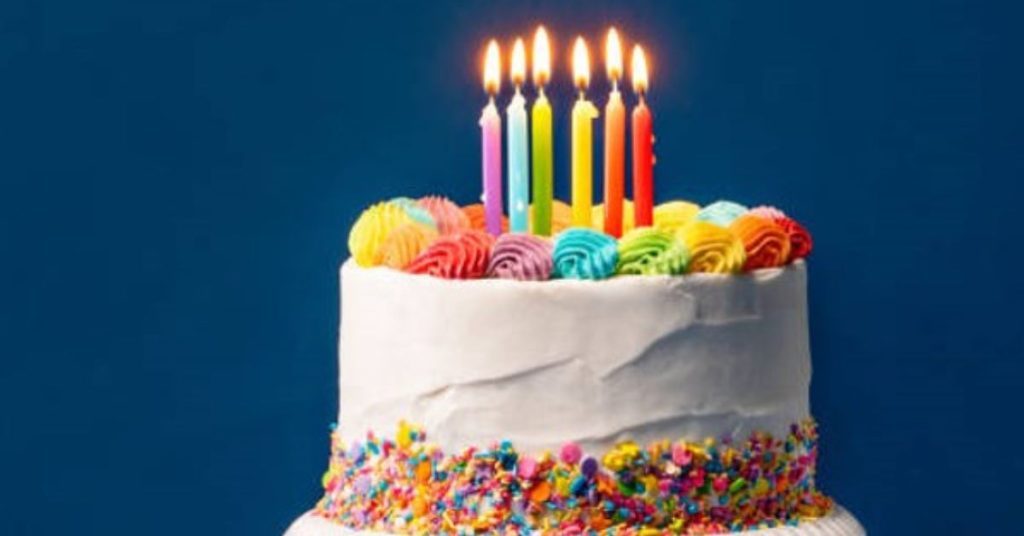
You are a GUI agent. You are given a task and a screenshot of the screen. Output one action in this format:
    pyautogui.click(x=<x>, y=<y>)
    Task: Click on the candle
    The height and width of the screenshot is (536, 1024).
    Given the screenshot: What is the action you would take?
    pyautogui.click(x=489, y=142), pyautogui.click(x=517, y=142), pyautogui.click(x=539, y=142), pyautogui.click(x=583, y=148), pyautogui.click(x=616, y=155), pyautogui.click(x=644, y=161)